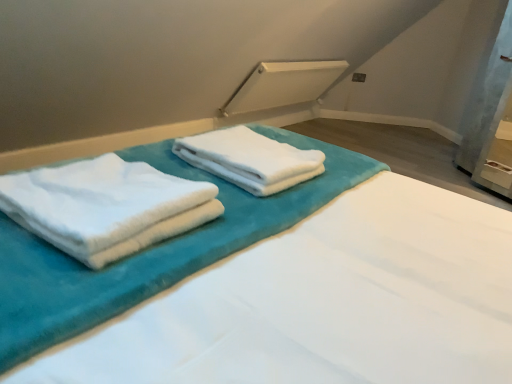
Question: Does point (506, 210) appear closer or farther from the camera than point (108, 192)?

Choices:
 (A) closer
 (B) farther

Answer: (B)

Question: In terms of height, does white soft towels at center look taller or shorter compared to white fluffy towels at left, the second towel positioned from the back?

Choices:
 (A) short
 (B) tall

Answer: (B)

Question: Which is farther from the white soft towels at center?

Choices:
 (A) white fluffy towels at left, the second towel positioned from the back
 (B) white soft towel at center, arranged as the second towel when viewed from the front

Answer: (A)

Question: Considering the real-world distances, which object is farthest from the white soft towel at center, arranged as the second towel when viewed from the front?

Choices:
 (A) white fluffy towels at left, the 1th towel in the front-to-back sequence
 (B) white soft towels at center

Answer: (A)